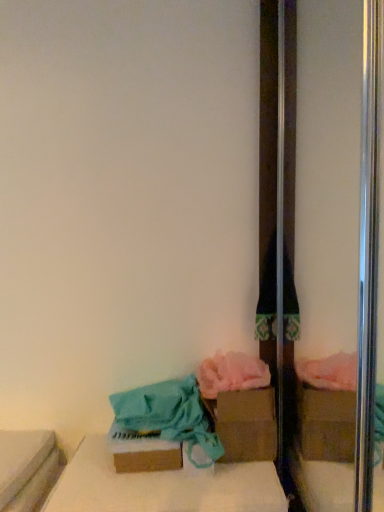
I want to click on vacant space positioned to the left of brown cardboard box at lower center, the first cardboard box positioned from the front, so click(x=89, y=473).